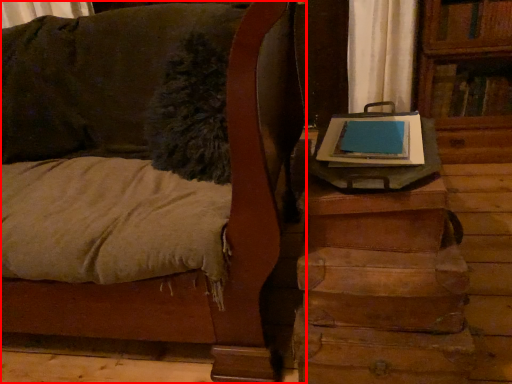
Question: From the image's perspective, what is the correct spatial relationship of furniture (annotated by the red box) in relation to table?

Choices:
 (A) below
 (B) above

Answer: (B)